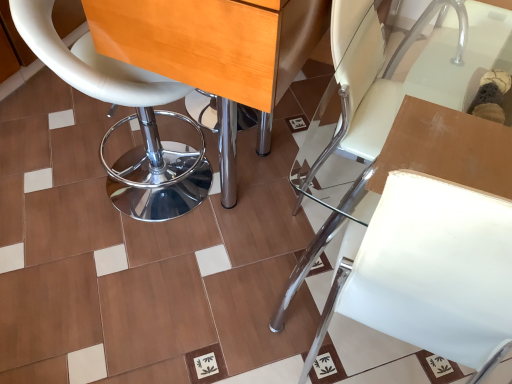
Question: Is white leather stool at left, which is the 2th chair from right to left, completely or partially inside white leather chair at center, the first chair in the right-to-left sequence?

Choices:
 (A) yes
 (B) no

Answer: (B)

Question: Is white leather chair at center, the first chair in the right-to-left sequence, to the left of white leather stool at left, placed as the first chair when sorted from left to right, from the viewer's perspective?

Choices:
 (A) yes
 (B) no

Answer: (B)

Question: Does white leather chair at center, the first chair in the right-to-left sequence, turn towards white leather stool at left, which is the 2th chair from right to left?

Choices:
 (A) no
 (B) yes

Answer: (A)

Question: Considering the relative positions of white leather chair at center, placed as the 2th chair when sorted from left to right, and white leather stool at left, placed as the first chair when sorted from left to right, in the image provided, is white leather chair at center, placed as the 2th chair when sorted from left to right, to the right of white leather stool at left, placed as the first chair when sorted from left to right, from the viewer's perspective?

Choices:
 (A) yes
 (B) no

Answer: (A)

Question: Is white leather chair at center, placed as the 2th chair when sorted from left to right, closer to camera compared to white leather stool at left, placed as the first chair when sorted from left to right?

Choices:
 (A) yes
 (B) no

Answer: (A)

Question: Considering the relative positions of white leather stool at left, placed as the first chair when sorted from left to right, and white leather chair at center, the first chair in the right-to-left sequence, in the image provided, is white leather stool at left, placed as the first chair when sorted from left to right, to the left or to the right of white leather chair at center, the first chair in the right-to-left sequence,?

Choices:
 (A) right
 (B) left

Answer: (B)

Question: In terms of height, does white leather stool at left, placed as the first chair when sorted from left to right, look taller or shorter compared to white leather chair at center, placed as the 2th chair when sorted from left to right?

Choices:
 (A) short
 (B) tall

Answer: (B)

Question: Is white leather stool at left, which is the 2th chair from right to left, spatially inside white leather chair at center, placed as the 2th chair when sorted from left to right, or outside of it?

Choices:
 (A) inside
 (B) outside

Answer: (B)

Question: Is point (102, 163) closer or farther from the camera than point (421, 86)?

Choices:
 (A) closer
 (B) farther

Answer: (B)

Question: From a real-world perspective, is wooden table at center physically located above or below white leather stool at left, placed as the first chair when sorted from left to right?

Choices:
 (A) below
 (B) above

Answer: (B)

Question: Is wooden table at center bigger or smaller than white leather stool at left, placed as the first chair when sorted from left to right?

Choices:
 (A) small
 (B) big

Answer: (B)

Question: Considering their positions, is wooden table at center located in front of or behind white leather stool at left, which is the 2th chair from right to left?

Choices:
 (A) front
 (B) behind

Answer: (A)

Question: Is wooden table at center inside the boundaries of white leather stool at left, which is the 2th chair from right to left, or outside?

Choices:
 (A) outside
 (B) inside

Answer: (A)

Question: Looking at their shapes, would you say white leather stool at left, placed as the first chair when sorted from left to right, is wider or thinner than wooden table at center?

Choices:
 (A) thin
 (B) wide

Answer: (A)

Question: From the image's perspective, is white leather stool at left, placed as the first chair when sorted from left to right, located above or below wooden table at center?

Choices:
 (A) below
 (B) above

Answer: (A)